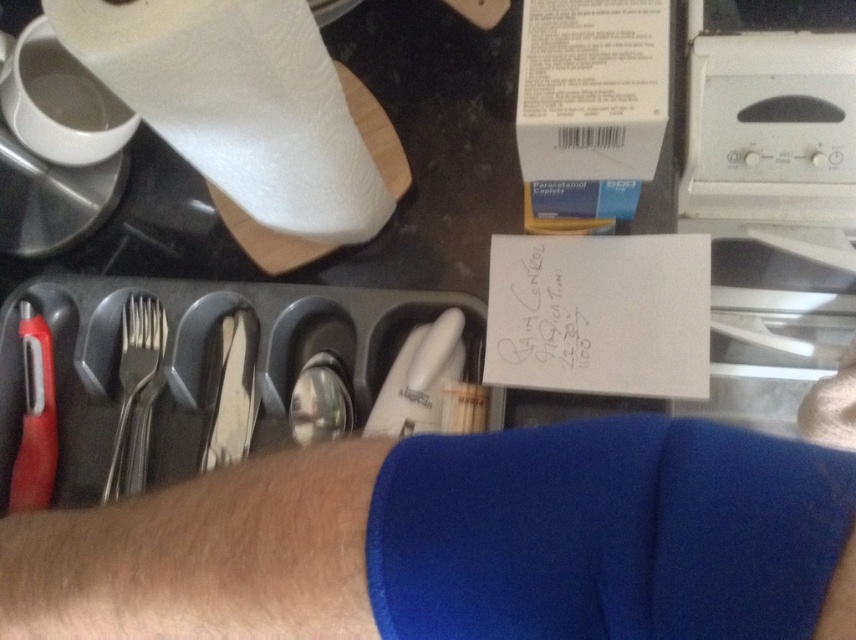
Question: Which object is the farthest from the satin silver fork at left?

Choices:
 (A) satin silverware at center
 (B) blue fabric arm at center
 (C) white paper towel at upper left

Answer: (B)

Question: Where is blue fabric arm at center located in relation to red plastic knife at left in the image?

Choices:
 (A) right
 (B) left

Answer: (A)

Question: Which object is closer to the camera taking this photo?

Choices:
 (A) blue fabric arm at center
 (B) red plastic knife at left
 (C) white paper towel at upper left
 (D) satin silverware at center

Answer: (A)

Question: Can you confirm if blue fabric arm at center is positioned below white paper towel at upper left?

Choices:
 (A) no
 (B) yes

Answer: (B)

Question: Does white paper towel at upper left have a smaller size compared to satin silver fork at left?

Choices:
 (A) no
 (B) yes

Answer: (A)

Question: Among these objects, which one is nearest to the camera?

Choices:
 (A) blue fabric arm at center
 (B) satin silverware at center
 (C) satin silver fork at left

Answer: (A)